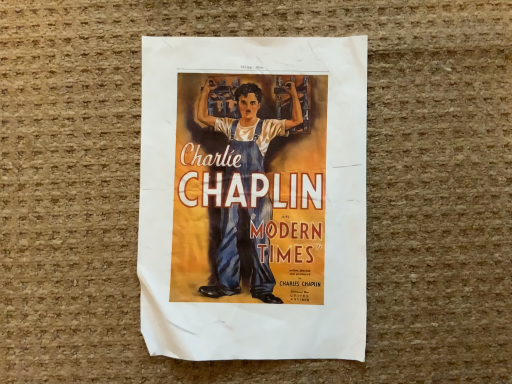
At what (x,y) coordinates should I click in order to perform the action: click on vacant area on top of matte paper poster at center (from a real-world perspective). Please return your answer as a coordinate pair (x, y). Image resolution: width=512 pixels, height=384 pixels. Looking at the image, I should click on (261, 195).